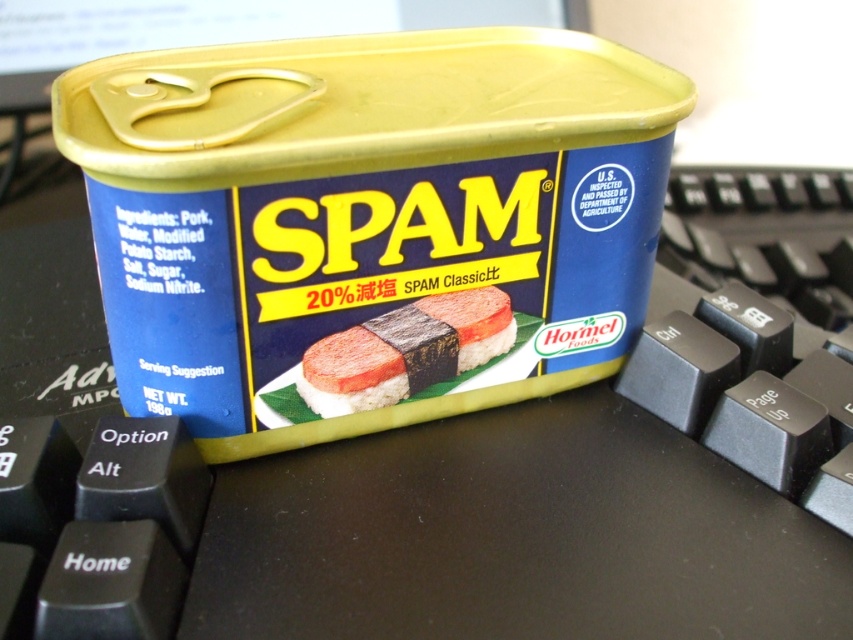
Question: Which object appears closest to the camera in this image?

Choices:
 (A) yellow matte plastic can at center
 (B) pinkish-red soft-textured spam at center

Answer: (A)

Question: Can you confirm if yellow matte plastic can at center is positioned below pinkish-red soft-textured spam at center?

Choices:
 (A) no
 (B) yes

Answer: (A)

Question: Which of the following is the farthest from the observer?

Choices:
 (A) yellow matte plastic can at center
 (B) pinkish-red soft-textured spam at center

Answer: (B)

Question: Where is yellow matte plastic can at center located in relation to pinkish-red soft-textured spam at center in the image?

Choices:
 (A) right
 (B) left

Answer: (B)

Question: Does yellow matte plastic can at center appear under pinkish-red soft-textured spam at center?

Choices:
 (A) yes
 (B) no

Answer: (B)